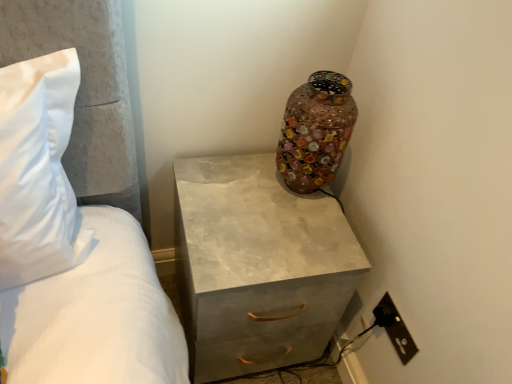
Identify the location of vacant area that lies in front of multicolored mosaic vase at upper right. The image size is (512, 384). (x=290, y=233).